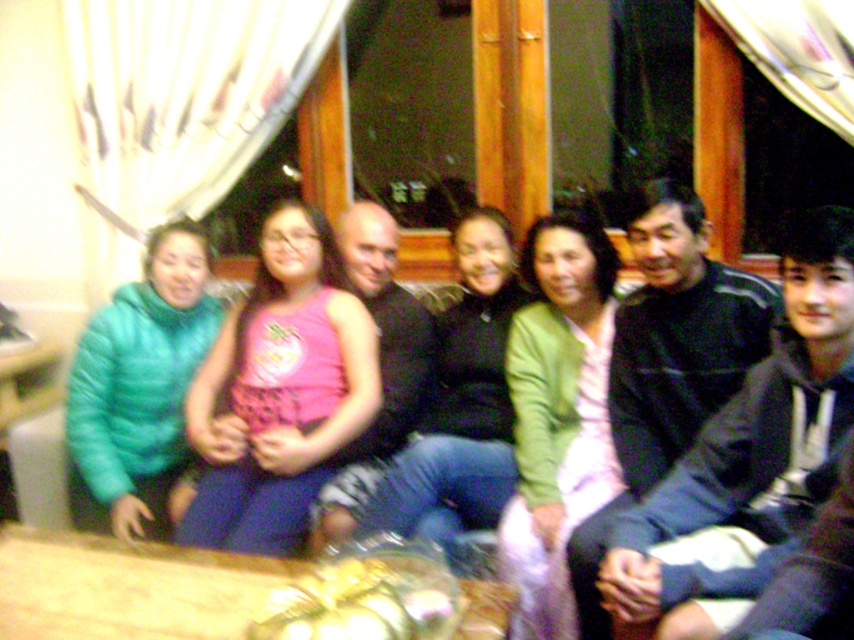
You are a photographer trying to capture a group photo of the teal puffy jacket at left and the matte black sweater at center. If you want to ensure both are fully visible in the frame, which clothing item should you focus on adjusting the camera angle for?

The teal puffy jacket at left is shorter than the matte black sweater at center, so you should focus on adjusting the camera angle to accommodate the taller matte black sweater at center to ensure both are fully visible.

You are standing in the room and want to find the green matte sweater at center. Which direction should you look to locate the point at coordinates point [557,417]?

The point at coordinates point [557,417] is on the green matte sweater at center, so you should look towards the center of the room to find it.